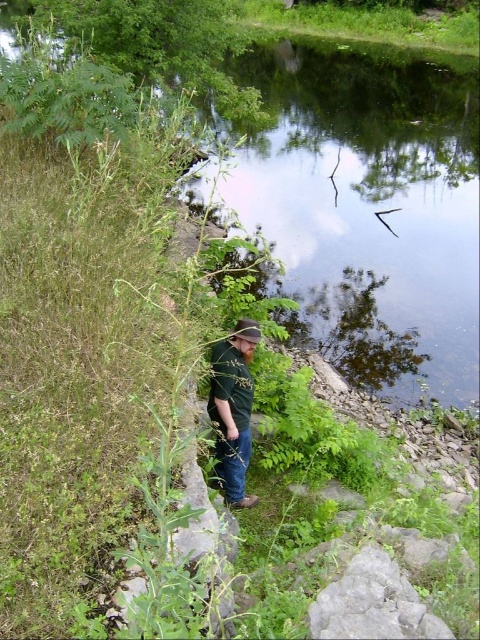
Is green matte shirt at center bigger than brown fabric baseball hat at center?

Correct, green matte shirt at center is larger in size than brown fabric baseball hat at center.

In the scene shown: Can you confirm if green matte shirt at center is positioned above brown fabric baseball hat at center?

Incorrect, green matte shirt at center is not positioned above brown fabric baseball hat at center.

Is point (236, 413) closer to camera compared to point (231, 333)?

No.

At what (x,y) coordinates should I click in order to perform the action: click on green matte shirt at center. Please return your answer as a coordinate pair (x, y). Looking at the image, I should click on (233, 408).